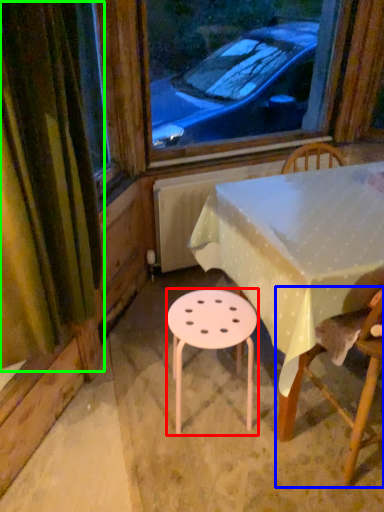
Question: Estimate the real-world distances between objects in this image. Which object is farther from stool (highlighted by a red box), chair (highlighted by a blue box) or curtain (highlighted by a green box)?

Choices:
 (A) chair
 (B) curtain

Answer: (B)